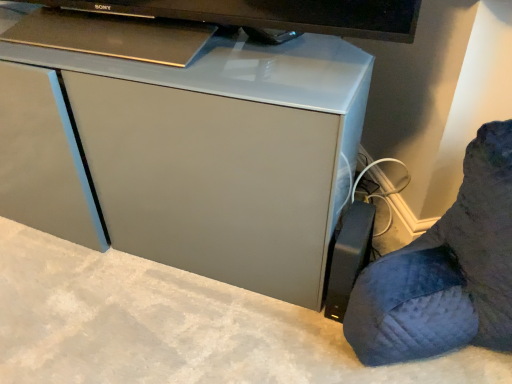
Question: Is black plastic power strip at lower right inside matte gray cabinet at center?

Choices:
 (A) yes
 (B) no

Answer: (B)

Question: Is matte gray cabinet at center at the left side of black plastic power strip at lower right?

Choices:
 (A) no
 (B) yes

Answer: (B)

Question: Can you confirm if matte gray cabinet at center is smaller than black plastic power strip at lower right?

Choices:
 (A) yes
 (B) no

Answer: (B)

Question: Considering the relative sizes of matte gray cabinet at center and black plastic power strip at lower right in the image provided, is matte gray cabinet at center shorter than black plastic power strip at lower right?

Choices:
 (A) no
 (B) yes

Answer: (A)

Question: From the image's perspective, is matte gray cabinet at center located beneath black plastic power strip at lower right?

Choices:
 (A) no
 (B) yes

Answer: (A)

Question: Does matte gray cabinet at center have a lesser width compared to black plastic power strip at lower right?

Choices:
 (A) yes
 (B) no

Answer: (A)

Question: Is black plastic power strip at lower right closer to the viewer compared to matte gray cabinet at center?

Choices:
 (A) no
 (B) yes

Answer: (B)

Question: From the image's perspective, is black plastic power strip at lower right located beneath matte gray cabinet at center?

Choices:
 (A) no
 (B) yes

Answer: (B)

Question: Can we say black plastic power strip at lower right lies outside matte gray cabinet at center?

Choices:
 (A) yes
 (B) no

Answer: (A)

Question: Can you confirm if black plastic power strip at lower right is taller than matte gray cabinet at center?

Choices:
 (A) yes
 (B) no

Answer: (B)

Question: From the image's perspective, is black plastic power strip at lower right located above matte gray cabinet at center?

Choices:
 (A) no
 (B) yes

Answer: (A)

Question: Is black plastic power strip at lower right facing towards matte gray cabinet at center?

Choices:
 (A) no
 (B) yes

Answer: (A)

Question: Would you say black plastic power strip at lower right is to the left or to the right of matte gray cabinet at center in the picture?

Choices:
 (A) left
 (B) right

Answer: (B)